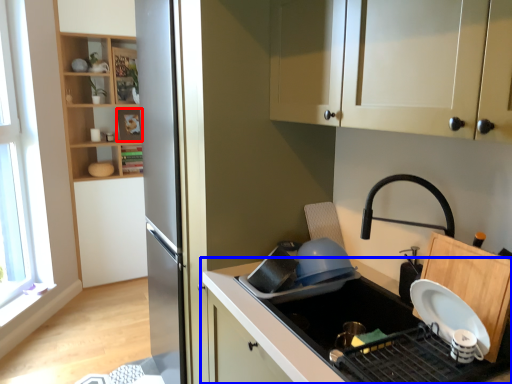
Question: Among these objects, which one is nearest to the camera, shelf (highlighted by a red box) or countertop (highlighted by a blue box)?

Choices:
 (A) shelf
 (B) countertop

Answer: (B)